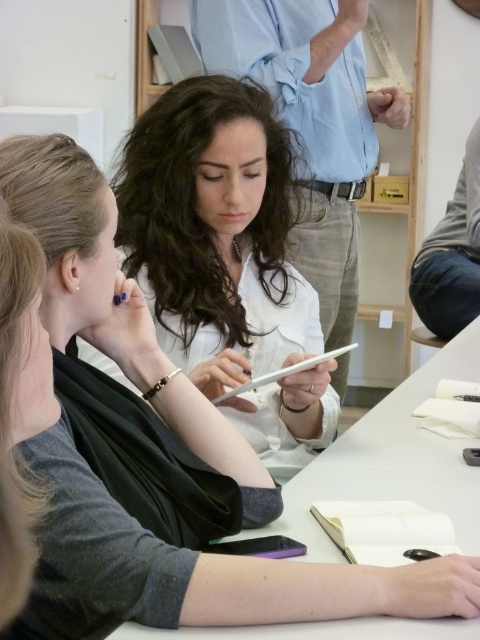
You are a person with a 12 inch laptop who wants to place it on the table. The white matte tablet at center is already on the white matte table at center. Can you put your laptop next to the tablet on the table?

The white matte tablet at center is 19.19 inches from white matte table at center. Since the distance between the tablet and the edge of the table is 19.19 inches, there is enough space to place your 12 inch laptop next to the tablet on the white matte table at center.

You are standing at the entrance of the room. You need to locate the white matte tablet at center. According to the coordinates provided, where should you look to find it?

The white matte tablet at center is located at coordinates point (216, 232), so you should look towards the lower central area of the room.

You are a participant in this meeting and need to place a 12cm tall document on the white matte tablet at center and the white matte table at center. Which surface can accommodate the document without it being too tall?

The white matte tablet at center is much taller than the white matte table at center. Therefore, the document will fit better on the white matte tablet at center since it can accommodate taller items.